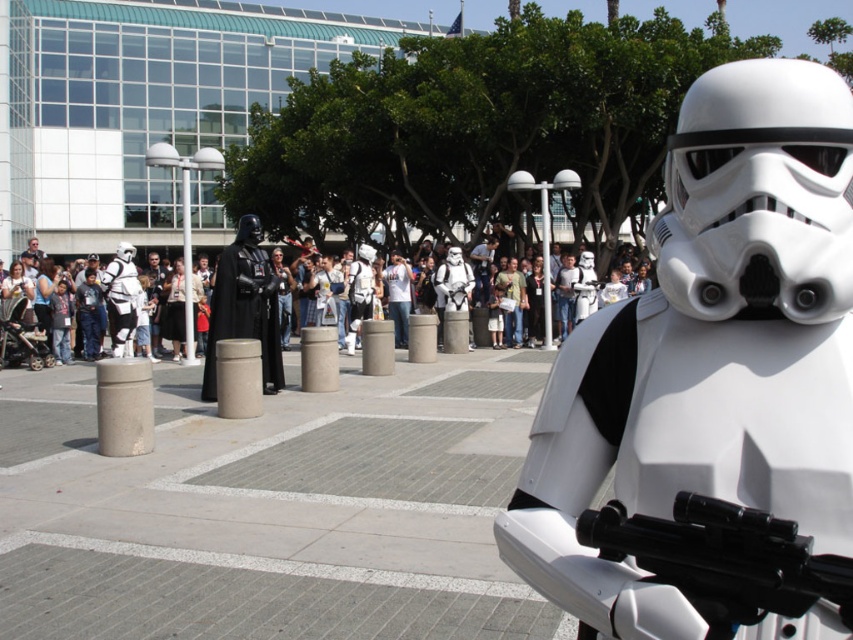
Between black plastic gun at lower right and white matte stormtrooper at center, which one appears on the left side from the viewer's perspective?

white matte stormtrooper at center is more to the left.

Can you confirm if black plastic gun at lower right is bigger than white matte stormtrooper at center?

Incorrect, black plastic gun at lower right is not larger than white matte stormtrooper at center.

Is point (701, 524) closer to camera compared to point (320, 308)?

Yes.

You are a GUI agent. You are given a task and a screenshot of the screen. Output one action in this format:
    pyautogui.click(x=<x>, y=<y>)
    Task: Click on the black plastic gun at lower right
    
    Given the screenshot: What is the action you would take?
    pyautogui.click(x=723, y=560)

Is white matte stormtrooper helmet at center to the left of matte black armor at center from the viewer's perspective?

Incorrect, white matte stormtrooper helmet at center is not on the left side of matte black armor at center.

Does white matte stormtrooper helmet at center appear under matte black armor at center?

Yes, white matte stormtrooper helmet at center is below matte black armor at center.

Is point (810, 189) closer to viewer compared to point (241, 266)?

Yes, it is.

At what (x,y) coordinates should I click in order to perform the action: click on white matte stormtrooper helmet at center. Please return your answer as a coordinate pair (x, y). Looking at the image, I should click on (712, 388).

Who is more distant from viewer, (248, 253) or (524, 294)?

The point (524, 294) is more distant.

Is point (213, 378) positioned in front of point (149, 280)?

Yes.

Is point (265, 294) behind point (96, 346)?

No, (265, 294) is closer to viewer.

This screenshot has width=853, height=640. I want to click on matte black armor at center, so click(244, 307).